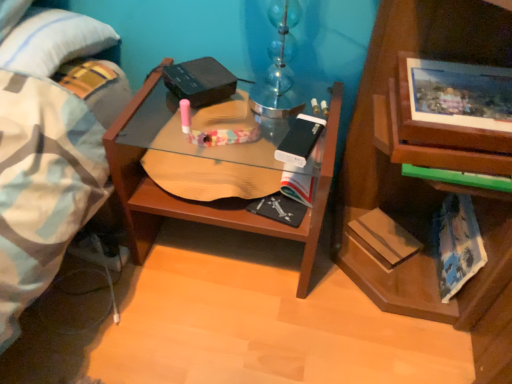
This screenshot has height=384, width=512. What are the coordinates of `free space to the left of hardcover book at lower right, the second paperback book in the left-to-right sequence` in the screenshot? It's located at (315, 257).